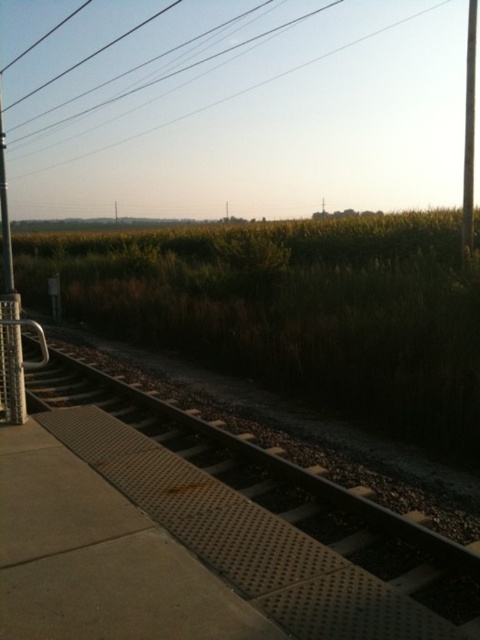
You are a railway inspector checking the platform. You notice the brown textured track at center and the metallic pole at right. Which object appears smaller in the image?

The brown textured track at center appears smaller than the metallic pole at right in the image.

You are standing on the railway platform and want to determine which of the two points, point (323,10) or point (472,122), is closer to you. Based on the scene, which point is nearer?

Point (323,10) is closer to the camera than point (472,122), so it is nearer to you.